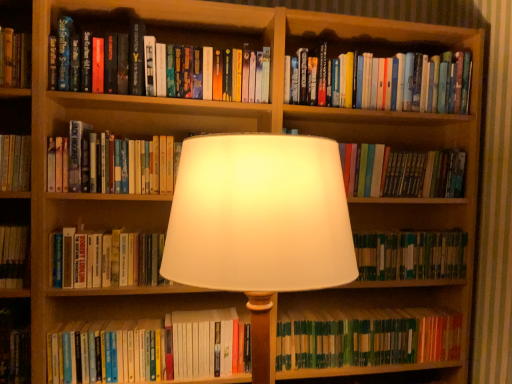
Question: Is green matte book at lower right, arranged as the first book when ordered from the bottom, at the right side of hardcover book at center, which appears as the third book when viewed from the top?

Choices:
 (A) yes
 (B) no

Answer: (A)

Question: Is the position of green matte book at lower right, arranged as the first book when ordered from the bottom, less distant than that of hardcover book at center, which appears as the third book when viewed from the top?

Choices:
 (A) yes
 (B) no

Answer: (B)

Question: Is green matte book at lower right, arranged as the first book when ordered from the bottom, far from hardcover book at center, acting as the sixth book starting from the bottom?

Choices:
 (A) no
 (B) yes

Answer: (A)

Question: Does green matte book at lower right, arranged as the first book when ordered from the bottom, lie behind hardcover book at center, acting as the sixth book starting from the bottom?

Choices:
 (A) yes
 (B) no

Answer: (A)

Question: From a real-world perspective, does green matte book at lower right, arranged as the first book when ordered from the bottom, sit lower than hardcover book at center, acting as the sixth book starting from the bottom?

Choices:
 (A) no
 (B) yes

Answer: (B)

Question: From the image's perspective, is hardcover books at lower center, the second book from the bottom, above or below green matte book at lower right, the 8th book positioned from the top?

Choices:
 (A) below
 (B) above

Answer: (B)

Question: From a real-world perspective, relative to green matte book at lower right, the 8th book positioned from the top, is hardcover books at lower center, arranged as the seventh book when viewed from the top, vertically above or below?

Choices:
 (A) below
 (B) above

Answer: (B)

Question: Choose the correct answer: Is hardcover books at lower center, the second book from the bottom, inside green matte book at lower right, the 8th book positioned from the top, or outside it?

Choices:
 (A) inside
 (B) outside

Answer: (B)

Question: Is hardcover books at lower center, arranged as the seventh book when viewed from the top, wider or thinner than green matte book at lower right, arranged as the first book when ordered from the bottom?

Choices:
 (A) wide
 (B) thin

Answer: (A)

Question: From the image's perspective, is green matte book at center, which ranks as the 6th book in top-to-bottom order, positioned above or below hardcover book at center, acting as the sixth book starting from the bottom?

Choices:
 (A) below
 (B) above

Answer: (A)

Question: Is point (440, 249) positioned closer to the camera than point (111, 135)?

Choices:
 (A) closer
 (B) farther

Answer: (B)

Question: Considering their positions, is green matte book at center, the third book from the bottom, located in front of or behind hardcover book at center, acting as the sixth book starting from the bottom?

Choices:
 (A) front
 (B) behind

Answer: (B)

Question: Is green matte book at center, the third book from the bottom, taller or shorter than hardcover book at center, which appears as the third book when viewed from the top?

Choices:
 (A) short
 (B) tall

Answer: (A)

Question: From the image's perspective, relative to hardcover book at center, the fourth book in the bottom-to-top sequence, is green matte book at center, which ranks as the 6th book in top-to-bottom order, above or below?

Choices:
 (A) above
 (B) below

Answer: (B)

Question: In terms of size, does green matte book at center, which ranks as the 6th book in top-to-bottom order, appear bigger or smaller than hardcover book at center, the fourth book in the bottom-to-top sequence?

Choices:
 (A) small
 (B) big

Answer: (A)